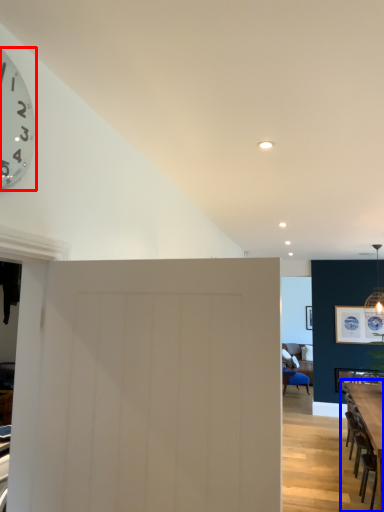
Question: Which object is further to the camera taking this photo, wall clock (highlighted by a red box) or table (highlighted by a blue box)?

Choices:
 (A) wall clock
 (B) table

Answer: (B)